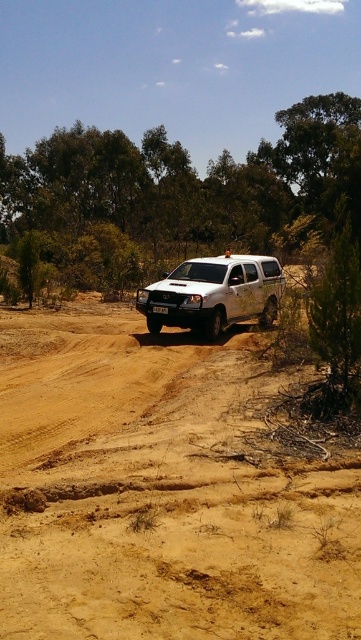
You are a driver in a white Toyota Hilux 4x4 vehicle. You need to decide whether to drive straight ahead through the brown sandy terrain at center and the green leafy tree at center. Based on their widths, can you safely pass through without hitting the tree?

The brown sandy terrain at center is thinner than the green leafy tree at center, so the vehicle can safely pass through the brown sandy terrain at center as it is narrower than the tree, but must ensure there is enough space between them to avoid collision.

Consider the image. You are a driver of a white Toyota Hilux 4x4 vehicle currently on a sandy terrain. You need to reach a point marked by point (161, 490). Based on the image, can you determine if the sandy terrain at that point is suitable for driving?

The brown sandy terrain at center represented by point (161, 490) is suitable for driving as it is part of the sandy, uneven terrain where the vehicle is already navigating, indicating it can handle such conditions.